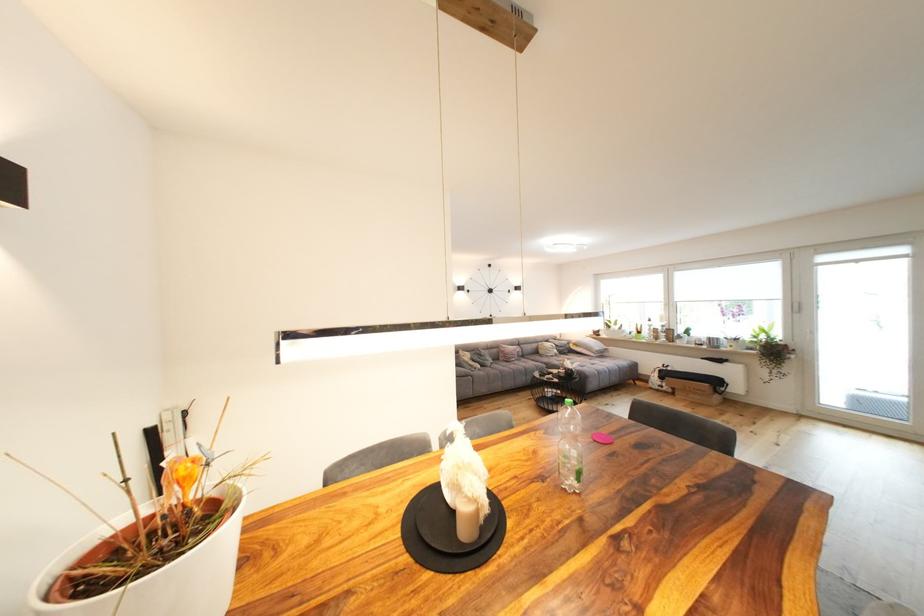
Where would you pull the white door handle? Please return your answer as a coordinate pair (x, y).

(807, 334)